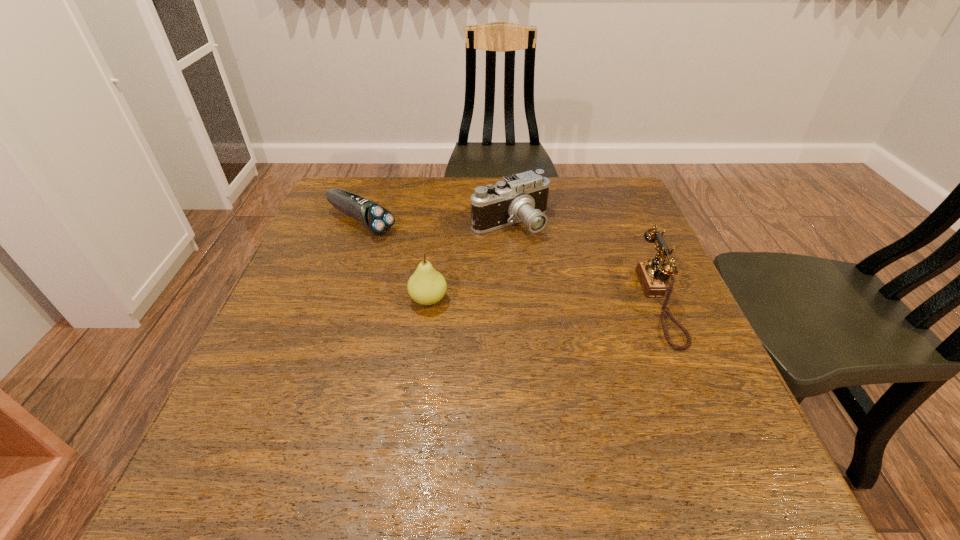
At what (x,y) coordinates should I click in order to perform the action: click on vacant space located 0.270m at the lens of the camera. Please return your answer as a coordinate pair (x, y). Image resolution: width=960 pixels, height=540 pixels. Looking at the image, I should click on (576, 315).

I want to click on blank space located 0.400m at the lens of the camera, so click(610, 362).

At what (x,y) coordinates should I click in order to perform the action: click on electric shaver located at the far edge. Please return your answer as a coordinate pair (x, y). The width and height of the screenshot is (960, 540). Looking at the image, I should click on (376, 219).

Identify the location of camera that is at the far edge. (522, 197).

Find the location of a particular element. This screenshot has width=960, height=540. object at the left edge is located at coordinates (376, 219).

Where is `object at the right edge`? object at the right edge is located at coordinates (652, 277).

The image size is (960, 540). I want to click on object located at the far left corner, so click(x=376, y=219).

The height and width of the screenshot is (540, 960). Identify the location of vacant space at the far edge of the desktop. (456, 211).

This screenshot has height=540, width=960. I want to click on blank space at the near edge of the desktop, so click(x=368, y=400).

Find the location of a particular element. This screenshot has width=960, height=540. free region at the left edge is located at coordinates (334, 258).